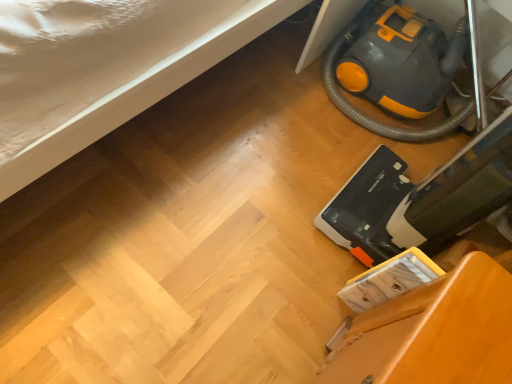
Question: Is yellow-orange plastic vacuum cleaner at lower right, the second equipment when ordered from back to front, surrounding yellow-orange plastic vacuum cleaner at lower right, which is counted as the second equipment, starting from the front?

Choices:
 (A) yes
 (B) no

Answer: (B)

Question: From a real-world perspective, is yellow-orange plastic vacuum cleaner at lower right, the first equipment viewed from the front, on top of yellow-orange plastic vacuum cleaner at lower right, which is counted as the second equipment, starting from the front?

Choices:
 (A) no
 (B) yes

Answer: (B)

Question: From the image's perspective, is yellow-orange plastic vacuum cleaner at lower right, the second equipment when ordered from back to front, on yellow-orange plastic vacuum cleaner at lower right, placed as the 1th equipment when sorted from back to front?

Choices:
 (A) yes
 (B) no

Answer: (B)

Question: Does yellow-orange plastic vacuum cleaner at lower right, the first equipment viewed from the front, have a larger size compared to yellow-orange plastic vacuum cleaner at lower right, placed as the 1th equipment when sorted from back to front?

Choices:
 (A) yes
 (B) no

Answer: (B)

Question: Considering the relative positions of yellow-orange plastic vacuum cleaner at lower right, the second equipment when ordered from back to front, and yellow-orange plastic vacuum cleaner at lower right, which is counted as the second equipment, starting from the front, in the image provided, is yellow-orange plastic vacuum cleaner at lower right, the second equipment when ordered from back to front, to the left of yellow-orange plastic vacuum cleaner at lower right, which is counted as the second equipment, starting from the front, from the viewer's perspective?

Choices:
 (A) no
 (B) yes

Answer: (B)

Question: Is yellow-orange plastic vacuum cleaner at lower right, the first equipment viewed from the front, not near yellow-orange plastic vacuum cleaner at lower right, which is counted as the second equipment, starting from the front?

Choices:
 (A) yes
 (B) no

Answer: (B)

Question: Is yellow-orange plastic vacuum cleaner at lower right, the first equipment viewed from the front, to the left of wooden chair at lower right from the viewer's perspective?

Choices:
 (A) yes
 (B) no

Answer: (B)

Question: Is yellow-orange plastic vacuum cleaner at lower right, the second equipment when ordered from back to front, aimed at wooden chair at lower right?

Choices:
 (A) no
 (B) yes

Answer: (A)

Question: From the image's perspective, is yellow-orange plastic vacuum cleaner at lower right, the second equipment when ordered from back to front, below wooden chair at lower right?

Choices:
 (A) no
 (B) yes

Answer: (A)

Question: Is there a large distance between yellow-orange plastic vacuum cleaner at lower right, the first equipment viewed from the front, and wooden chair at lower right?

Choices:
 (A) no
 (B) yes

Answer: (A)

Question: Can you confirm if yellow-orange plastic vacuum cleaner at lower right, the first equipment viewed from the front, is thinner than wooden chair at lower right?

Choices:
 (A) yes
 (B) no

Answer: (B)

Question: Considering the relative sizes of yellow-orange plastic vacuum cleaner at lower right, the first equipment viewed from the front, and wooden chair at lower right in the image provided, is yellow-orange plastic vacuum cleaner at lower right, the first equipment viewed from the front, shorter than wooden chair at lower right?

Choices:
 (A) no
 (B) yes

Answer: (A)

Question: Considering the relative positions of yellow-orange plastic vacuum cleaner at lower right, which is counted as the second equipment, starting from the front, and yellow-orange plastic vacuum cleaner at lower right, the first equipment viewed from the front, in the image provided, is yellow-orange plastic vacuum cleaner at lower right, which is counted as the second equipment, starting from the front, to the right of yellow-orange plastic vacuum cleaner at lower right, the first equipment viewed from the front, from the viewer's perspective?

Choices:
 (A) no
 (B) yes

Answer: (B)